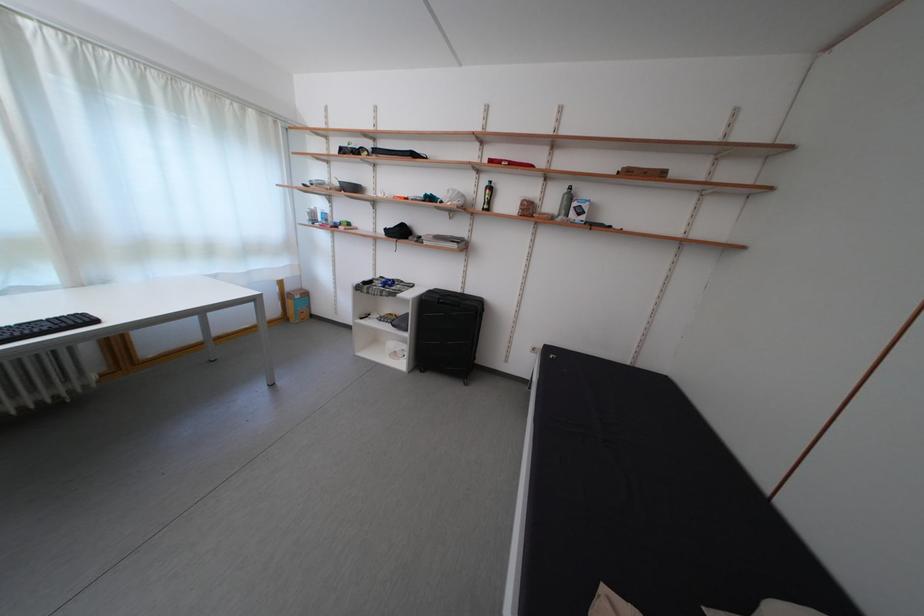
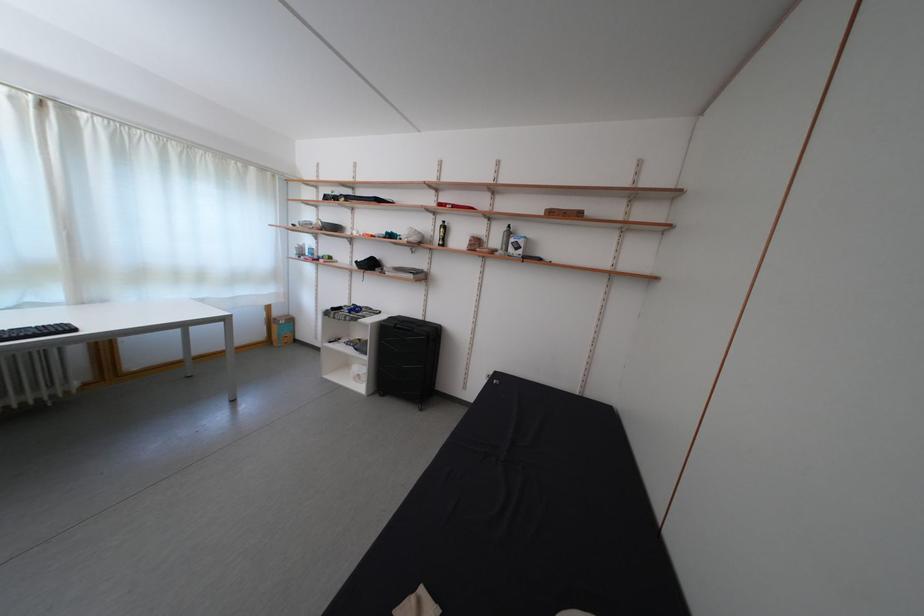
Question: In a continuous first-person perspective shot, in which direction is the camera moving?

Choices:
 (A) Left
 (B) Right
 (C) Forward
 (D) Backward

Answer: (B)